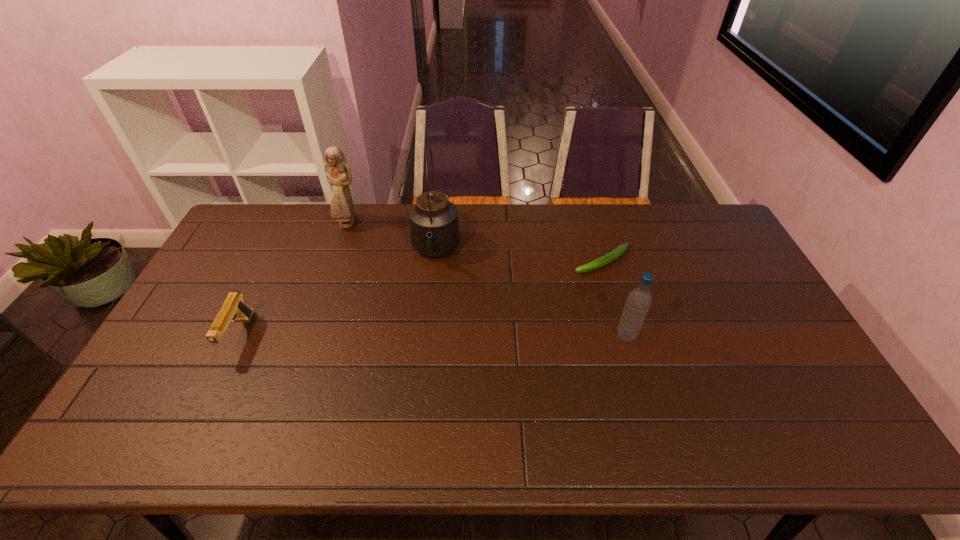
Find the location of a particular element. vacant space located on the front-facing side of the zucchini is located at coordinates (507, 306).

In order to click on vacant region located on the front-facing side of the zucchini in this screenshot , I will do `click(482, 319)`.

I want to click on free space located 0.160m on the front-facing side of the zucchini, so click(540, 288).

Find the location of a particular element. The height and width of the screenshot is (540, 960). free region located spout on the tallest object is located at coordinates (432, 289).

This screenshot has height=540, width=960. Find the location of `blank area located 0.250m spout on the tallest object`. blank area located 0.250m spout on the tallest object is located at coordinates (427, 339).

I want to click on free space located spout on the tallest object, so click(427, 339).

I want to click on vacant space situated 0.260m on the front-facing side of the fourth shortest object, so click(x=373, y=276).

The image size is (960, 540). Find the location of `free space located on the front-facing side of the fourth shortest object`. free space located on the front-facing side of the fourth shortest object is located at coordinates (371, 271).

You are a GUI agent. You are given a task and a screenshot of the screen. Output one action in this format:
    pyautogui.click(x=<x>, y=<y>)
    Task: Click on the vacant space located 0.310m on the front-facing side of the fourth shortest object
    
    Given the screenshot: What is the action you would take?
    pyautogui.click(x=378, y=287)

You are a GUI agent. You are given a task and a screenshot of the screen. Output one action in this format:
    pyautogui.click(x=<x>, y=<y>)
    Task: Click on the kettle present at the far edge
    
    Given the screenshot: What is the action you would take?
    pyautogui.click(x=434, y=228)